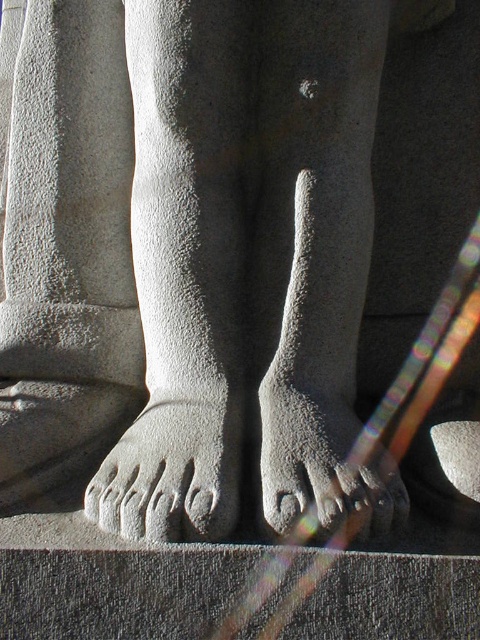
Between gray stone foot at lower center and gray stone foot at center, which one is positioned higher?

gray stone foot at center

Can you confirm if gray stone foot at lower center is positioned to the right of gray stone foot at center?

Result: Incorrect, gray stone foot at lower center is not on the right side of gray stone foot at center.

Who is more forward, (205, 500) or (308, 417)?

Point (205, 500)

The width and height of the screenshot is (480, 640). Identify the location of gray stone foot at lower center. (171, 474).